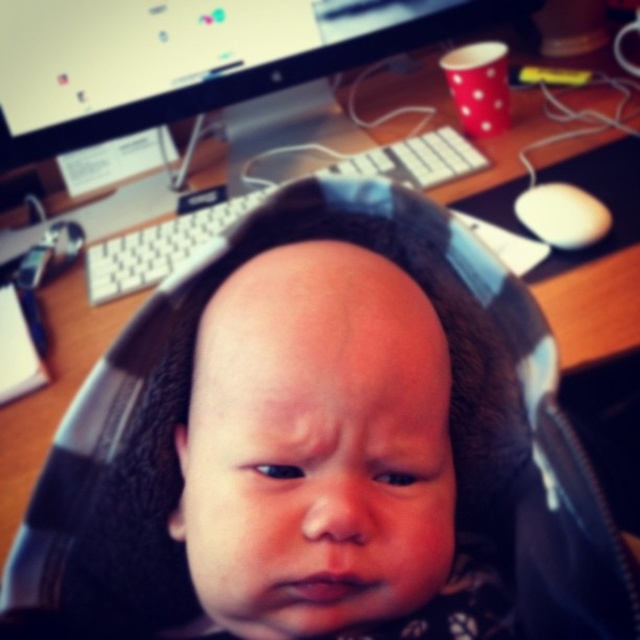
Question: Is smooth skin baby at center wider than white plastic keyboard at center?

Choices:
 (A) no
 (B) yes

Answer: (A)

Question: Where is smooth skin baby at center located in relation to white plastic keyboard at center in the image?

Choices:
 (A) below
 (B) above

Answer: (A)

Question: Among these objects, which one is nearest to the camera?

Choices:
 (A) smooth skin baby at center
 (B) white plastic keyboard at center

Answer: (A)

Question: Which of the following is the farthest from the observer?

Choices:
 (A) (392, 156)
 (B) (296, 449)

Answer: (A)

Question: Can you confirm if smooth skin baby at center is positioned below white plastic keyboard at center?

Choices:
 (A) no
 (B) yes

Answer: (B)